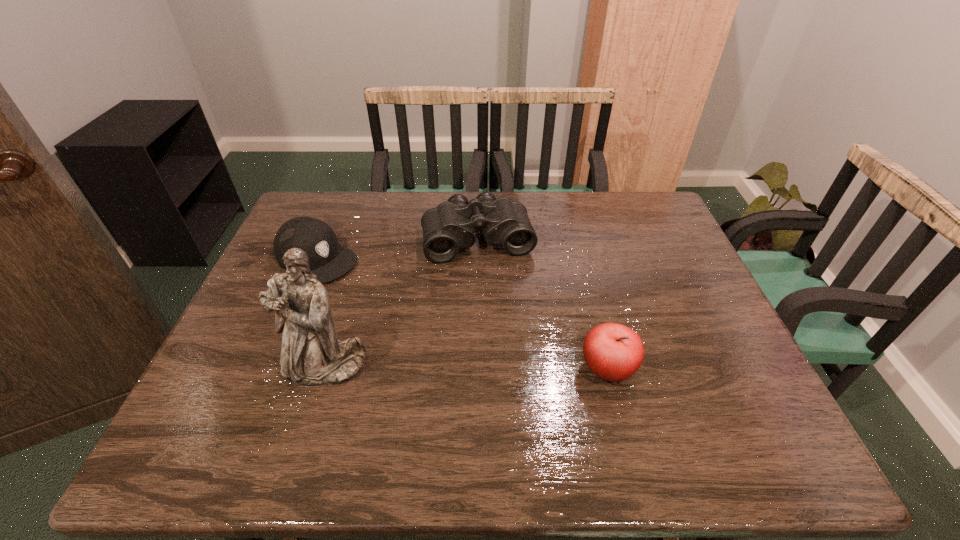
Where is `free spot located at the eyepieces of the binoculars`? The height and width of the screenshot is (540, 960). free spot located at the eyepieces of the binoculars is located at coordinates (513, 375).

Identify the location of object that is at the far edge. (448, 227).

At what (x,y) coordinates should I click in order to perform the action: click on figurine that is at the near edge. Please return your answer as a coordinate pair (x, y). Looking at the image, I should click on (312, 355).

The width and height of the screenshot is (960, 540). I want to click on apple located at the near edge, so click(x=613, y=352).

Locate an element on the screen. This screenshot has height=540, width=960. object that is at the left edge is located at coordinates (328, 260).

At what (x,y) coordinates should I click in order to perform the action: click on vacant area at the far edge of the desktop. Please return your answer as a coordinate pair (x, y). Looking at the image, I should click on (537, 200).

The height and width of the screenshot is (540, 960). I want to click on free space at the near edge of the desktop, so click(454, 386).

In the image, there is a desktop. At what (x,y) coordinates should I click in order to perform the action: click on vacant space at the left edge. Please return your answer as a coordinate pair (x, y). Looking at the image, I should click on (263, 337).

In order to click on vacant space at the right edge in this screenshot , I will do `click(693, 373)`.

This screenshot has width=960, height=540. I want to click on free space at the far left corner of the desktop, so click(x=310, y=217).